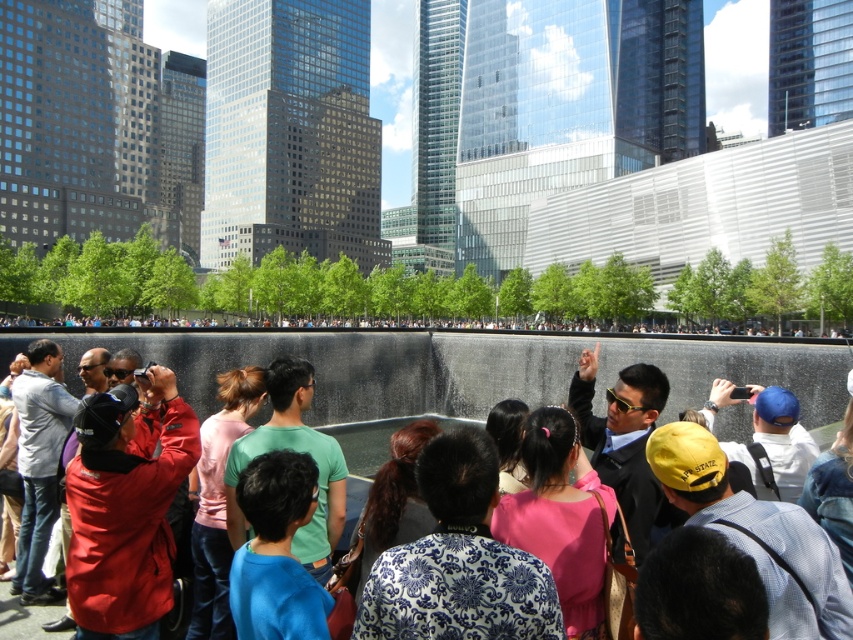
Question: Which point appears farthest from the camera in this image?

Choices:
 (A) (140, 579)
 (B) (596, 600)
 (C) (677, 618)

Answer: (A)

Question: Does red matte jacket at lower left appear under dark blue fabric at lower center?

Choices:
 (A) no
 (B) yes

Answer: (A)

Question: In this image, where is red matte jacket at lower left located relative to blue and white patterned shirt at center?

Choices:
 (A) left
 (B) right

Answer: (A)

Question: Is dark blue fabric at lower center smaller than black hair at center?

Choices:
 (A) no
 (B) yes

Answer: (B)

Question: Considering the real-world distances, which object is closest to the red matte jacket at lower left?

Choices:
 (A) pink fabric shirt at center
 (B) yellow fabric cap at lower right

Answer: (A)

Question: Among these points, which one is farthest from the camera?

Choices:
 (A) (834, 476)
 (B) (735, 560)
 (C) (200, 481)

Answer: (C)